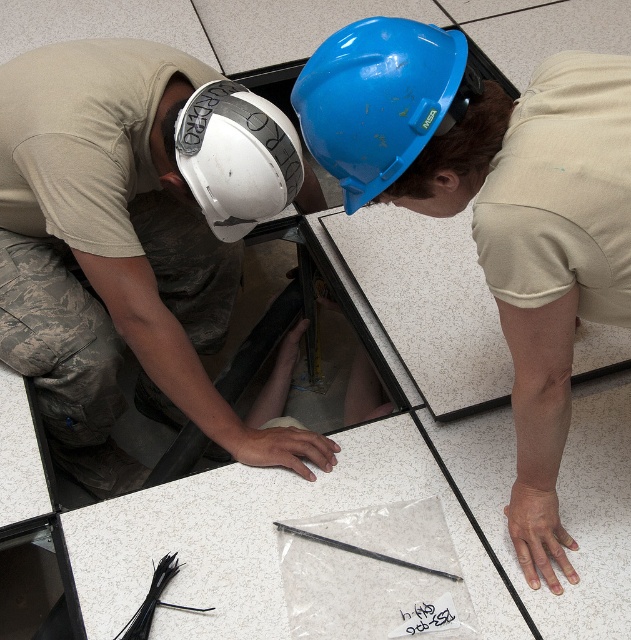
From the picture: Can you confirm if white matte hard hat at left is positioned to the right of blue hard hat at center?

In fact, white matte hard hat at left is to the left of blue hard hat at center.

How much distance is there between white matte hard hat at left and blue hard hat at center?

white matte hard hat at left and blue hard hat at center are 65.71 centimeters apart.

This screenshot has height=640, width=631. I want to click on white matte hard hat at left, so click(114, 257).

Who is higher up, white matte hard hat at left or white matte helmet at upper left?

white matte helmet at upper left is above.

Who is more distant from viewer, [100,42] or [257,97]?

Point [100,42]

Find the location of a particular element. Image resolution: width=631 pixels, height=640 pixels. white matte hard hat at left is located at coordinates (114, 257).

Between blue hard hat at center and blue glossy hard hat at upper center, which one has more height?

With more height is blue hard hat at center.

Based on the photo, can you confirm if blue hard hat at center is positioned to the right of blue glossy hard hat at upper center?

Correct, you'll find blue hard hat at center to the right of blue glossy hard hat at upper center.

Who is more forward, (423, 72) or (353, 156)?

Positioned in front is point (423, 72).

Locate an element on the screen. The width and height of the screenshot is (631, 640). blue hard hat at center is located at coordinates (493, 209).